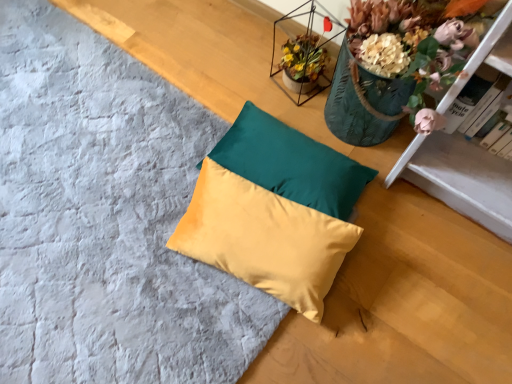
Question: Could hardcover book at upper right be considered to be inside satin yellow pillow at center, acting as the first pillow starting from the bottom?

Choices:
 (A) no
 (B) yes

Answer: (A)

Question: Does satin yellow pillow at center, acting as the first pillow starting from the bottom, have a greater width compared to hardcover book at upper right?

Choices:
 (A) yes
 (B) no

Answer: (A)

Question: Can you confirm if satin yellow pillow at center, which is the 2th pillow in top-to-bottom order, is taller than hardcover book at upper right?

Choices:
 (A) yes
 (B) no

Answer: (B)

Question: From a real-world perspective, is satin yellow pillow at center, acting as the first pillow starting from the bottom, over hardcover book at upper right?

Choices:
 (A) no
 (B) yes

Answer: (A)

Question: Can you see satin yellow pillow at center, acting as the first pillow starting from the bottom, touching hardcover book at upper right?

Choices:
 (A) yes
 (B) no

Answer: (B)

Question: Is satin yellow pillow at center, marked as the second pillow in a bottom-to-top arrangement, wider or thinner than hardcover book at upper right?

Choices:
 (A) wide
 (B) thin

Answer: (A)

Question: Considering their positions, is satin yellow pillow at center, placed as the first pillow when sorted from top to bottom, located in front of or behind hardcover book at upper right?

Choices:
 (A) behind
 (B) front

Answer: (A)

Question: From the image's perspective, is satin yellow pillow at center, marked as the second pillow in a bottom-to-top arrangement, located above or below hardcover book at upper right?

Choices:
 (A) above
 (B) below

Answer: (B)

Question: Does point (254, 162) appear closer or farther from the camera than point (492, 107)?

Choices:
 (A) closer
 (B) farther

Answer: (B)

Question: Considering their positions, is satin yellow pillow at center, placed as the first pillow when sorted from top to bottom, located in front of or behind satin yellow pillow at center, acting as the first pillow starting from the bottom?

Choices:
 (A) front
 (B) behind

Answer: (B)

Question: Would you say satin yellow pillow at center, marked as the second pillow in a bottom-to-top arrangement, is to the left or to the right of satin yellow pillow at center, which is the 2th pillow in top-to-bottom order, in the picture?

Choices:
 (A) right
 (B) left

Answer: (A)

Question: Looking at the image, does satin yellow pillow at center, marked as the second pillow in a bottom-to-top arrangement, seem bigger or smaller compared to satin yellow pillow at center, which is the 2th pillow in top-to-bottom order?

Choices:
 (A) small
 (B) big

Answer: (A)

Question: From a real-world perspective, is satin yellow pillow at center, marked as the second pillow in a bottom-to-top arrangement, above or below satin yellow pillow at center, which is the 2th pillow in top-to-bottom order?

Choices:
 (A) below
 (B) above

Answer: (A)

Question: Choose the correct answer: Is hardcover book at upper right inside satin yellow pillow at center, placed as the first pillow when sorted from top to bottom, or outside it?

Choices:
 (A) inside
 (B) outside

Answer: (B)

Question: Looking at their shapes, would you say hardcover book at upper right is wider or thinner than satin yellow pillow at center, marked as the second pillow in a bottom-to-top arrangement?

Choices:
 (A) thin
 (B) wide

Answer: (A)